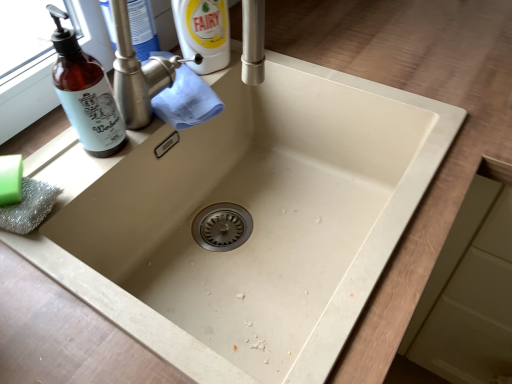
Question: From the image's perspective, is green matte soap at lower left under brown glass bottle at left?

Choices:
 (A) no
 (B) yes

Answer: (B)

Question: Is green matte soap at lower left behind brown glass bottle at left?

Choices:
 (A) no
 (B) yes

Answer: (B)

Question: Is green matte soap at lower left in front of brown glass bottle at left?

Choices:
 (A) yes
 (B) no

Answer: (B)

Question: Is green matte soap at lower left facing away from brown glass bottle at left?

Choices:
 (A) yes
 (B) no

Answer: (B)

Question: Considering the relative sizes of green matte soap at lower left and brown glass bottle at left in the image provided, is green matte soap at lower left shorter than brown glass bottle at left?

Choices:
 (A) yes
 (B) no

Answer: (A)

Question: Considering the positions of green matte soap at lower left and brown glass bottle at left in the image, is green matte soap at lower left bigger or smaller than brown glass bottle at left?

Choices:
 (A) small
 (B) big

Answer: (A)

Question: Considering the positions of green matte soap at lower left and brown glass bottle at left in the image, is green matte soap at lower left taller or shorter than brown glass bottle at left?

Choices:
 (A) tall
 (B) short

Answer: (B)

Question: Relative to brown glass bottle at left, is green matte soap at lower left in front or behind?

Choices:
 (A) behind
 (B) front

Answer: (A)

Question: Is point (13, 175) closer or farther from the camera than point (96, 132)?

Choices:
 (A) farther
 (B) closer

Answer: (B)

Question: Considering the positions of point (7, 168) and point (119, 77), is point (7, 168) closer or farther from the camera than point (119, 77)?

Choices:
 (A) farther
 (B) closer

Answer: (B)

Question: In terms of width, does green matte soap at lower left look wider or thinner when compared to brushed metal tap at upper center?

Choices:
 (A) thin
 (B) wide

Answer: (A)

Question: From a real-world perspective, is green matte soap at lower left physically located above or below brushed metal tap at upper center?

Choices:
 (A) above
 (B) below

Answer: (A)

Question: Is green matte soap at lower left in front of or behind brushed metal tap at upper center in the image?

Choices:
 (A) behind
 (B) front

Answer: (B)

Question: In terms of size, does brown glass bottle at left appear bigger or smaller than brushed metal tap at upper center?

Choices:
 (A) big
 (B) small

Answer: (B)

Question: Is brown glass bottle at left inside or outside of brushed metal tap at upper center?

Choices:
 (A) inside
 (B) outside

Answer: (B)